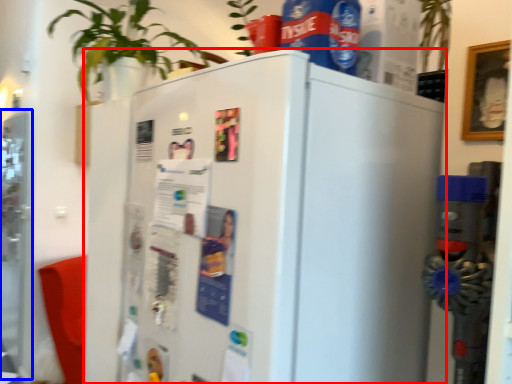
Question: Among these objects, which one is farthest to the camera, refrigerator (highlighted by a red box) or screen door (highlighted by a blue box)?

Choices:
 (A) refrigerator
 (B) screen door

Answer: (B)